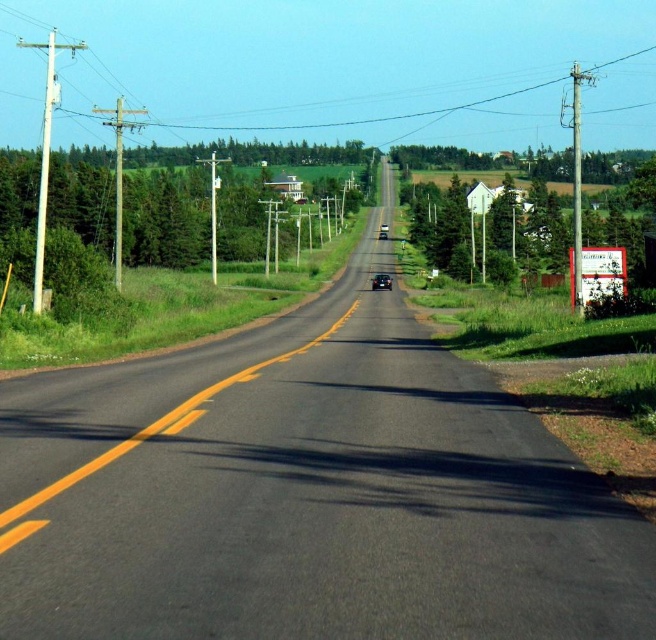
Question: From the image, what is the correct spatial relationship of green leafy tree at right in relation to shiny black car at center?

Choices:
 (A) below
 (B) above

Answer: (B)

Question: Among these objects, which one is farthest from the camera?

Choices:
 (A) green leafy tree at right
 (B) shiny black car at center

Answer: (B)

Question: Which point is farther from the camera taking this photo?

Choices:
 (A) (390, 280)
 (B) (447, 209)

Answer: (B)

Question: Is green leafy tree at right bigger than shiny black car at center?

Choices:
 (A) yes
 (B) no

Answer: (A)

Question: Observing the image, what is the correct spatial positioning of green leafy tree at right in reference to shiny black car at center?

Choices:
 (A) above
 (B) below

Answer: (A)